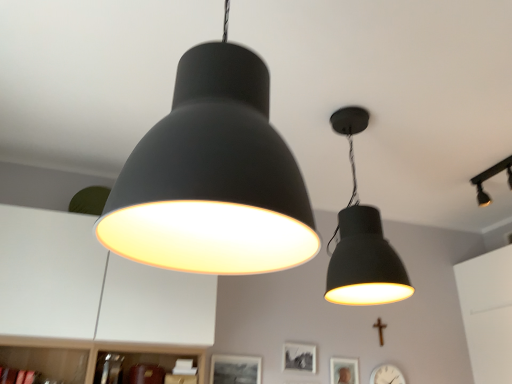
This screenshot has width=512, height=384. What do you see at coordinates (344, 370) in the screenshot?
I see `matte black picture frame at lower center, which is the 1th picture frame from right to left` at bounding box center [344, 370].

At what (x,y) coordinates should I click in order to perform the action: click on gold metallic crucifix at lower right. Please return your answer as a coordinate pair (x, y). This screenshot has width=512, height=384. Looking at the image, I should click on (380, 330).

You are a GUI agent. You are given a task and a screenshot of the screen. Output one action in this format:
    pyautogui.click(x=<x>, y=<y>)
    Task: Click on the matte black track light at upper right, the 3th lamp viewed from the left
    This screenshot has width=512, height=384.
    Given the screenshot: What is the action you would take?
    pyautogui.click(x=490, y=177)

Find the location of a particular element. The height and width of the screenshot is (384, 512). matte black lampshade at upper center, positioned as the first lamp in left-to-right order is located at coordinates (213, 177).

The image size is (512, 384). Identify the location of matte black picture frame at lower center, which appears as the 3th picture frame when viewed from the right. (234, 369).

Image resolution: width=512 pixels, height=384 pixels. In order to click on matte black picture frame at lower center, placed as the 3th picture frame when sorted from left to right in this screenshot , I will do pyautogui.click(x=344, y=370).

Find the location of a particular element. lamp that is the 1st object above the white glossy dresser at lower left (from a real-world perspective) is located at coordinates (213, 177).

Is matte black lampshade at upper center, acting as the first lamp starting from the front, further to the viewer compared to white glossy dresser at lower left?

No, matte black lampshade at upper center, acting as the first lamp starting from the front, is closer to the viewer.

Considering the positions of objects matte black lampshade at upper center, which is the 3th lamp from right to left, and white glossy dresser at lower left in the image provided, who is more to the right, matte black lampshade at upper center, which is the 3th lamp from right to left, or white glossy dresser at lower left?

From the viewer's perspective, matte black lampshade at upper center, which is the 3th lamp from right to left, appears more on the right side.

Is matte black picture frame at center, which is counted as the 2th picture frame, starting from the left, completely or partially inside matte black picture frame at lower center, which is the 1th picture frame from right to left?

No, matte black picture frame at lower center, which is the 1th picture frame from right to left, does not contain matte black picture frame at center, which is counted as the 2th picture frame, starting from the left.

Is matte black picture frame at lower center, placed as the 3th picture frame when sorted from left to right, further to camera compared to matte black picture frame at center, the 2th picture frame in the right-to-left sequence?

Yes, matte black picture frame at lower center, placed as the 3th picture frame when sorted from left to right, is further from the viewer.

In order to click on the 1st picture frame in front of the matte black picture frame at lower center, which is the 1th picture frame from right to left in this screenshot , I will do `click(300, 357)`.

From a real-world perspective, is matte black picture frame at lower center, placed as the 3th picture frame when sorted from left to right, physically located above or below matte black picture frame at center, the 2th picture frame in the right-to-left sequence?

Clearly, from a real-world perspective, matte black picture frame at lower center, placed as the 3th picture frame when sorted from left to right, is below matte black picture frame at center, the 2th picture frame in the right-to-left sequence.

Which object is positioned more to the right, matte black track light at upper right, which is the first lamp in right-to-left order, or gold metallic crucifix at lower right?

matte black track light at upper right, which is the first lamp in right-to-left order.

From their relative heights in the image, would you say matte black track light at upper right, marked as the third lamp in a front-to-back arrangement, is taller or shorter than gold metallic crucifix at lower right?

Considering their sizes, matte black track light at upper right, marked as the third lamp in a front-to-back arrangement, has more height than gold metallic crucifix at lower right.

In terms of size, does matte black track light at upper right, marked as the third lamp in a front-to-back arrangement, appear bigger or smaller than gold metallic crucifix at lower right?

matte black track light at upper right, marked as the third lamp in a front-to-back arrangement, is bigger than gold metallic crucifix at lower right.

How many degrees apart are the facing directions of matte black track light at upper right, marked as the third lamp in a front-to-back arrangement, and white matte clock at lower right?

The angle between the facing direction of matte black track light at upper right, marked as the third lamp in a front-to-back arrangement, and the facing direction of white matte clock at lower right is 1.27 degrees.

From the image's perspective, would you say matte black track light at upper right, which is the first lamp in right-to-left order, is shown under white matte clock at lower right?

No.

Is matte black track light at upper right, which is the first lamp in right-to-left order, to the left or to the right of white matte clock at lower right in the image?

Based on their positions, matte black track light at upper right, which is the first lamp in right-to-left order, is located to the right of white matte clock at lower right.

Is white matte clock at lower right completely or partially inside matte black track light at upper right, marked as the third lamp in a front-to-back arrangement?

No, white matte clock at lower right is located outside of matte black track light at upper right, marked as the third lamp in a front-to-back arrangement.

Which point is more forward, (216, 356) or (381, 340)?

The point (216, 356) is closer to the camera.

Which is correct: matte black picture frame at lower center, the 1th picture frame viewed from the left, is inside gold metallic crucifix at lower right, or outside of it?

matte black picture frame at lower center, the 1th picture frame viewed from the left, exists outside the volume of gold metallic crucifix at lower right.

Is matte black picture frame at lower center, which appears as the 3th picture frame when viewed from the right, wider or thinner than gold metallic crucifix at lower right?

Considering their sizes, matte black picture frame at lower center, which appears as the 3th picture frame when viewed from the right, looks slimmer than gold metallic crucifix at lower right.

From a real-world perspective, is matte black picture frame at lower center, which appears as the 3th picture frame when viewed from the right, physically located above or below gold metallic crucifix at lower right?

Clearly, from a real-world perspective, matte black picture frame at lower center, which appears as the 3th picture frame when viewed from the right, is below gold metallic crucifix at lower right.

Which is closer, (403, 381) or (480, 192)?

Point (403, 381) appears to be farther away from the viewer than point (480, 192).

From a real-world perspective, is white matte clock at lower right positioned above or below matte black track light at upper right, the 3th lamp viewed from the left?

In terms of real-world spatial position, white matte clock at lower right is below matte black track light at upper right, the 3th lamp viewed from the left.

From the picture: Is white matte clock at lower right bigger than matte black track light at upper right, which is the first lamp in right-to-left order?

Actually, white matte clock at lower right might be smaller than matte black track light at upper right, which is the first lamp in right-to-left order.

Based on the photo, from the image's perspective, which one is positioned higher, white matte clock at lower right or matte black track light at upper right, the 1th lamp positioned from the back?

matte black track light at upper right, the 1th lamp positioned from the back, is shown above in the image.

Looking at the image, does matte black picture frame at lower center, which appears as the 3th picture frame when viewed from the right, seem bigger or smaller compared to white glossy dresser at lower left?

Clearly, matte black picture frame at lower center, which appears as the 3th picture frame when viewed from the right, is smaller in size than white glossy dresser at lower left.

From a real-world perspective, who is located higher, matte black picture frame at lower center, the 1th picture frame viewed from the left, or white glossy dresser at lower left?

white glossy dresser at lower left, from a real-world perspective.

Which point is more distant from viewer, (241, 359) or (193, 306)?

The point (241, 359) is behind.

Between matte black picture frame at lower center, which appears as the 3th picture frame when viewed from the right, and white glossy dresser at lower left, which one has more height?

white glossy dresser at lower left.

You are a GUI agent. You are given a task and a screenshot of the screen. Output one action in this format:
    pyautogui.click(x=<x>, y=<y>)
    Task: Click on the 2nd lamp in front of the white glossy dresser at lower left
    
    Given the screenshot: What is the action you would take?
    pyautogui.click(x=213, y=177)

Locate an element on the screen. The height and width of the screenshot is (384, 512). picture frame that is the 2nd one when counting upward from the matte black picture frame at lower center, which is the 1th picture frame from right to left (from the image's perspective) is located at coordinates (300, 357).

Estimate the real-world distances between objects in this image. Which object is closer to matte black picture frame at center, the 2th picture frame in the right-to-left sequence, matte black picture frame at lower center, which appears as the 3th picture frame when viewed from the right, or matte black picture frame at lower center, placed as the 3th picture frame when sorted from left to right?

The object closer to matte black picture frame at center, the 2th picture frame in the right-to-left sequence, is matte black picture frame at lower center, placed as the 3th picture frame when sorted from left to right.

Which object lies further to the anchor point matte black lampshade at upper right, positioned as the second lamp in front-to-back order, matte black picture frame at lower center, placed as the 3th picture frame when sorted from left to right, or white matte clock at lower right?

Based on the image, white matte clock at lower right appears to be further to matte black lampshade at upper right, positioned as the second lamp in front-to-back order.

From the image, which object appears to be farther from white glossy dresser at lower left, matte black lampshade at upper center, positioned as the first lamp in left-to-right order, or matte black picture frame at center, which is counted as the 2th picture frame, starting from the left?

matte black lampshade at upper center, positioned as the first lamp in left-to-right order.

Considering their positions, is matte black picture frame at lower center, which is the 1th picture frame from right to left, positioned further to white matte clock at lower right than matte black picture frame at lower center, which appears as the 3th picture frame when viewed from the right?

Based on the image, matte black picture frame at lower center, which appears as the 3th picture frame when viewed from the right, appears to be further to white matte clock at lower right.

Based on the photo, when comparing their distances from matte black lampshade at upper center, which is the 3th lamp from right to left, does gold metallic crucifix at lower right or matte black picture frame at center, which is counted as the 2th picture frame, starting from the left, seem further?

Among the two, gold metallic crucifix at lower right is located further to matte black lampshade at upper center, which is the 3th lamp from right to left.

From the image, which object appears to be farther from matte black track light at upper right, which is the first lamp in right-to-left order, matte black picture frame at lower center, the 1th picture frame viewed from the left, or matte black picture frame at lower center, placed as the 3th picture frame when sorted from left to right?

matte black picture frame at lower center, the 1th picture frame viewed from the left, lies further to matte black track light at upper right, which is the first lamp in right-to-left order, than the other object.

Estimate the real-world distances between objects in this image. Which object is closer to white matte clock at lower right, matte black lampshade at upper right, which is counted as the 2th lamp, starting from the back, or matte black picture frame at lower center, which is the 1th picture frame from right to left?

matte black picture frame at lower center, which is the 1th picture frame from right to left, is closer to white matte clock at lower right.

From the image, which object appears to be farther from gold metallic crucifix at lower right, matte black lampshade at upper center, acting as the first lamp starting from the front, or matte black picture frame at lower center, the 1th picture frame viewed from the left?

matte black lampshade at upper center, acting as the first lamp starting from the front, is further to gold metallic crucifix at lower right.

Find the location of a particular element. This screenshot has height=384, width=512. crucifix between matte black track light at upper right, the 3th lamp viewed from the left, and white matte clock at lower right, in the vertical direction is located at coordinates (380, 330).

Locate an element on the screen. The height and width of the screenshot is (384, 512). lamp between matte black lampshade at upper right, which is counted as the 2th lamp, starting from the back, and gold metallic crucifix at lower right, along the z-axis is located at coordinates (490, 177).

You are a GUI agent. You are given a task and a screenshot of the screen. Output one action in this format:
    pyautogui.click(x=<x>, y=<y>)
    Task: Click on the lamp between matte black picture frame at center, the 2th picture frame in the right-to-left sequence, and matte black track light at upper right, marked as the third lamp in a front-to-back arrangement, in the horizontal direction
    The image size is (512, 384).
    Given the screenshot: What is the action you would take?
    pyautogui.click(x=362, y=241)

The height and width of the screenshot is (384, 512). What are the coordinates of `crucifix located between matte black picture frame at lower center, placed as the 3th picture frame when sorted from left to right, and white matte clock at lower right in the left-right direction` in the screenshot? It's located at (380, 330).